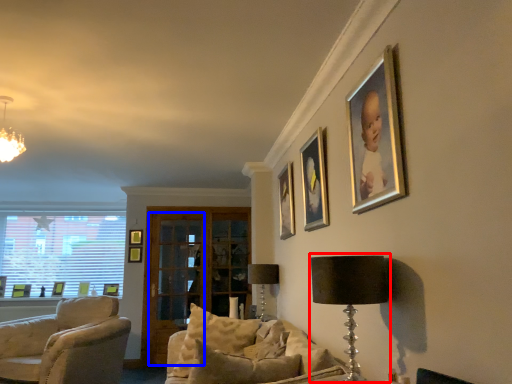
Question: Among these objects, which one is farthest to the camera, table lamp (highlighted by a red box) or glass door (highlighted by a blue box)?

Choices:
 (A) table lamp
 (B) glass door

Answer: (B)